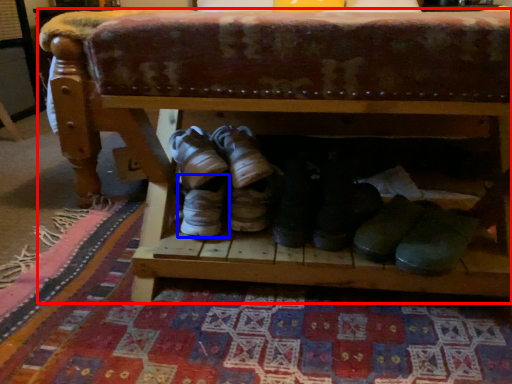
Question: Which point is further to the camera, furniture (highlighted by a red box) or footwear (highlighted by a blue box)?

Choices:
 (A) furniture
 (B) footwear

Answer: (B)